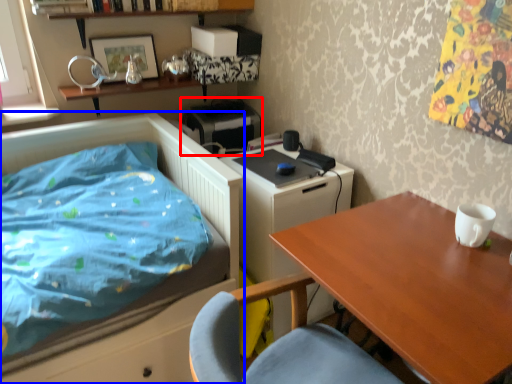
Question: Which of the following is the closest to the observer, printer (highlighted by a red box) or bed (highlighted by a blue box)?

Choices:
 (A) printer
 (B) bed

Answer: (B)